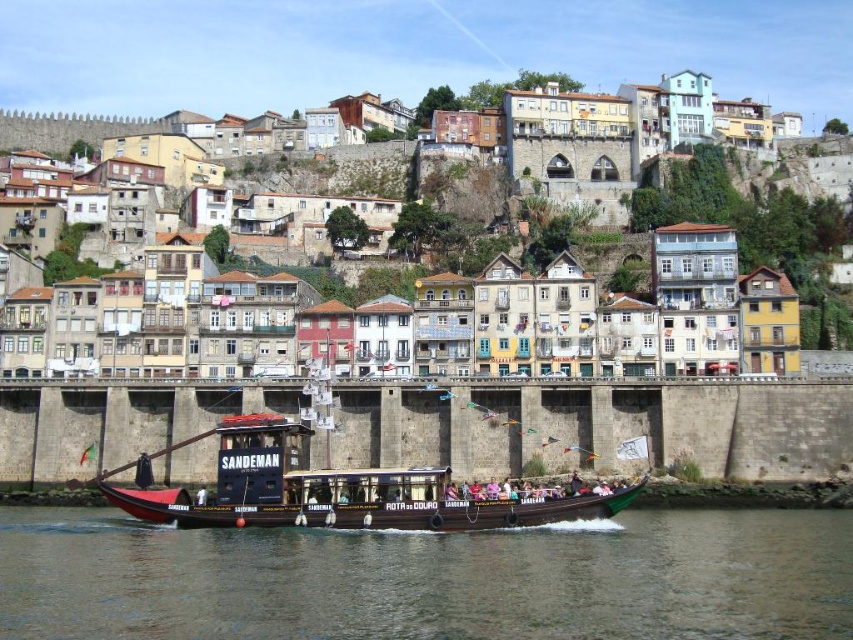
Question: Can you confirm if brown wooden boat at center is positioned below wooden boat at center?

Choices:
 (A) no
 (B) yes

Answer: (B)

Question: Which point is farther from the camera taking this photo?

Choices:
 (A) (x=15, y=554)
 (B) (x=595, y=492)

Answer: (B)

Question: Which object is positioned farthest from the multicolored wooden houses at center?

Choices:
 (A) brown wooden boat at center
 (B) wooden boat at center

Answer: (A)

Question: Observing the image, what is the correct spatial positioning of brown wooden boat at center in reference to multicolored wooden houses at center?

Choices:
 (A) left
 (B) right

Answer: (A)

Question: Which object appears farthest from the camera in this image?

Choices:
 (A) wooden boat at center
 (B) brown wooden boat at center
 (C) multicolored wooden houses at center

Answer: (C)

Question: Is brown wooden boat at center positioned at the back of wooden boat at center?

Choices:
 (A) no
 (B) yes

Answer: (A)